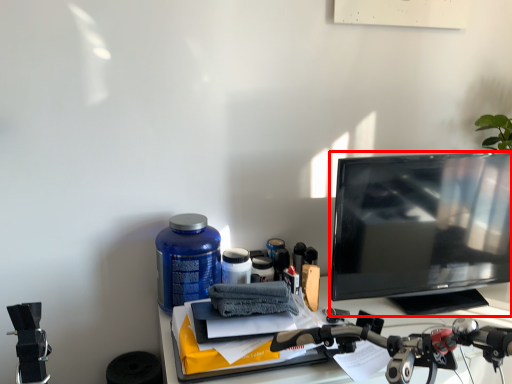
Question: From the image's perspective, what is the correct spatial positioning of television (annotated by the red box) in reference to bottle?

Choices:
 (A) below
 (B) above

Answer: (B)